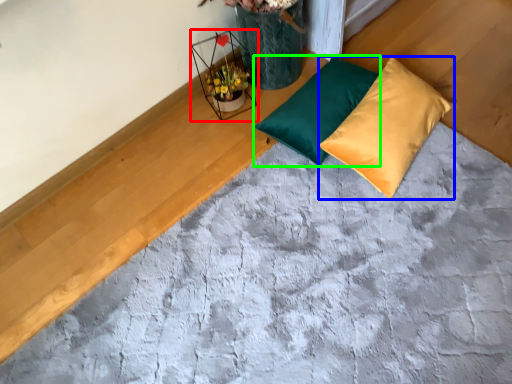
Question: Based on their relative distances, which object is farther from flower basket (highlighted by a red box)? Choose from pillow (highlighted by a blue box) and pillow (highlighted by a green box).

Choices:
 (A) pillow
 (B) pillow

Answer: (A)